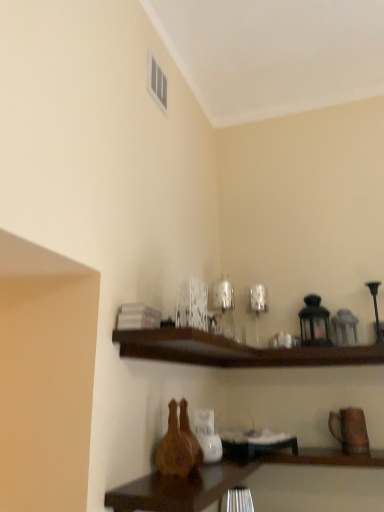
Question: From the image's perspective, is brown matte vase at lower right positioned above or below wooden table at lower center?

Choices:
 (A) below
 (B) above

Answer: (B)

Question: In the image, is brown matte vase at lower right positioned in front of or behind wooden table at lower center?

Choices:
 (A) behind
 (B) front

Answer: (A)

Question: Which object is the farthest from the matte white vent at upper center?

Choices:
 (A) brown matte vase at lower right
 (B) dark wood shelf at upper center
 (C) wooden table at lower center

Answer: (A)

Question: Which of these objects is positioned farthest from the dark wood shelf at upper center?

Choices:
 (A) wooden table at lower center
 (B) matte white vent at upper center
 (C) brown matte vase at lower right

Answer: (B)